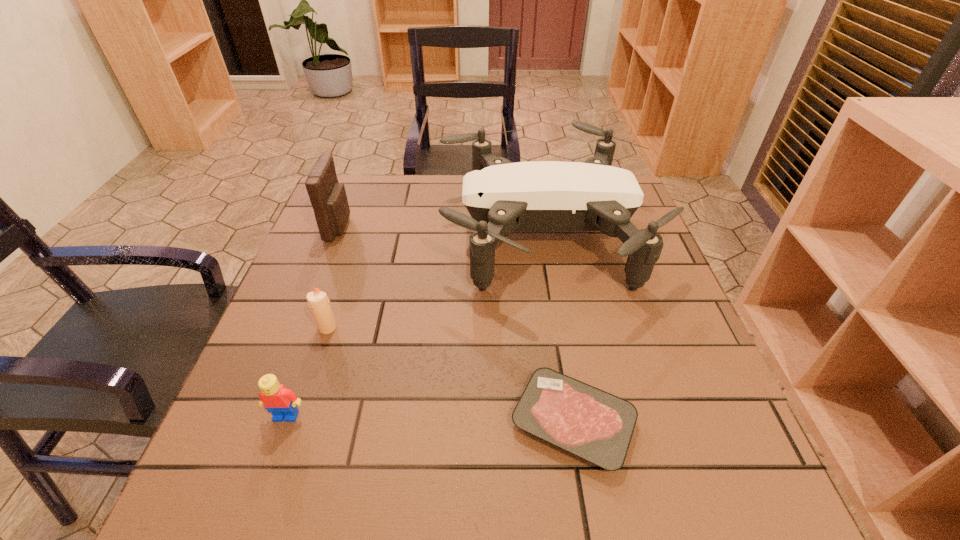
Locate an element on the screen. This screenshot has width=960, height=540. vacant region that satisfies the following two spatial constraints: 1. with an open flap on the pouch; 2. on the back side of the candle is located at coordinates (300, 328).

Where is `free location that satisfies the following two spatial constraints: 1. with an open flap on the pouch; 2. on the right side of the candle`? This screenshot has height=540, width=960. free location that satisfies the following two spatial constraints: 1. with an open flap on the pouch; 2. on the right side of the candle is located at coordinates (300, 328).

I want to click on free location that satisfies the following two spatial constraints: 1. with an open flap on the shortest object; 2. on the right side of the pouch, so [x=264, y=422].

You are a GUI agent. You are given a task and a screenshot of the screen. Output one action in this format:
    pyautogui.click(x=<x>, y=<y>)
    Task: Click on the vacant space that satisfies the following two spatial constraints: 1. on the front side of the candle; 2. on the left side of the steak
    
    Given the screenshot: What is the action you would take?
    pyautogui.click(x=297, y=422)